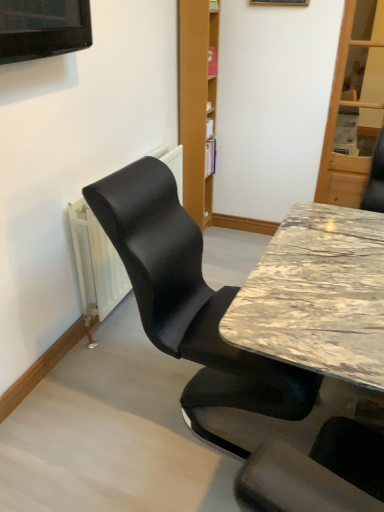
Question: Can you confirm if black leather chair at left is positioned to the right of marble table at center?

Choices:
 (A) yes
 (B) no

Answer: (B)

Question: Can you see black leather chair at left touching marble table at center?

Choices:
 (A) no
 (B) yes

Answer: (A)

Question: Is black leather chair at left smaller than marble table at center?

Choices:
 (A) yes
 (B) no

Answer: (A)

Question: Can you confirm if black leather chair at left is wider than marble table at center?

Choices:
 (A) yes
 (B) no

Answer: (A)

Question: Is black leather chair at left far from marble table at center?

Choices:
 (A) no
 (B) yes

Answer: (A)

Question: From a real-world perspective, is wooden bookshelf at upper center above or below black leather chair at left?

Choices:
 (A) above
 (B) below

Answer: (A)

Question: Based on their positions, is wooden bookshelf at upper center located to the left or right of black leather chair at left?

Choices:
 (A) right
 (B) left

Answer: (B)

Question: From their relative heights in the image, would you say wooden bookshelf at upper center is taller or shorter than black leather chair at left?

Choices:
 (A) short
 (B) tall

Answer: (A)

Question: Looking at their shapes, would you say wooden bookshelf at upper center is wider or thinner than black leather chair at left?

Choices:
 (A) wide
 (B) thin

Answer: (B)

Question: Is metallic gold picture frame at upper center in front of or behind black leather chair at left in the image?

Choices:
 (A) front
 (B) behind

Answer: (B)

Question: From a real-world perspective, relative to black leather chair at left, is metallic gold picture frame at upper center vertically above or below?

Choices:
 (A) above
 (B) below

Answer: (A)

Question: Is point (271, 0) positioned closer to the camera than point (158, 174)?

Choices:
 (A) closer
 (B) farther

Answer: (B)

Question: Which is correct: metallic gold picture frame at upper center is inside black leather chair at left, or outside of it?

Choices:
 (A) outside
 (B) inside

Answer: (A)

Question: From the image's perspective, is black leather chair at left located above or below wooden bookshelf at upper center?

Choices:
 (A) above
 (B) below

Answer: (B)

Question: Would you say black leather chair at left is to the left or to the right of wooden bookshelf at upper center in the picture?

Choices:
 (A) left
 (B) right

Answer: (B)